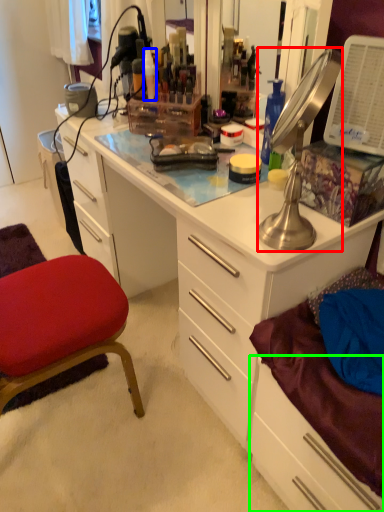
Question: Which object is the farthest from lamp (highlighted by a red box)? Choose among these: toiletry (highlighted by a blue box) or drawer (highlighted by a green box).

Choices:
 (A) toiletry
 (B) drawer

Answer: (A)